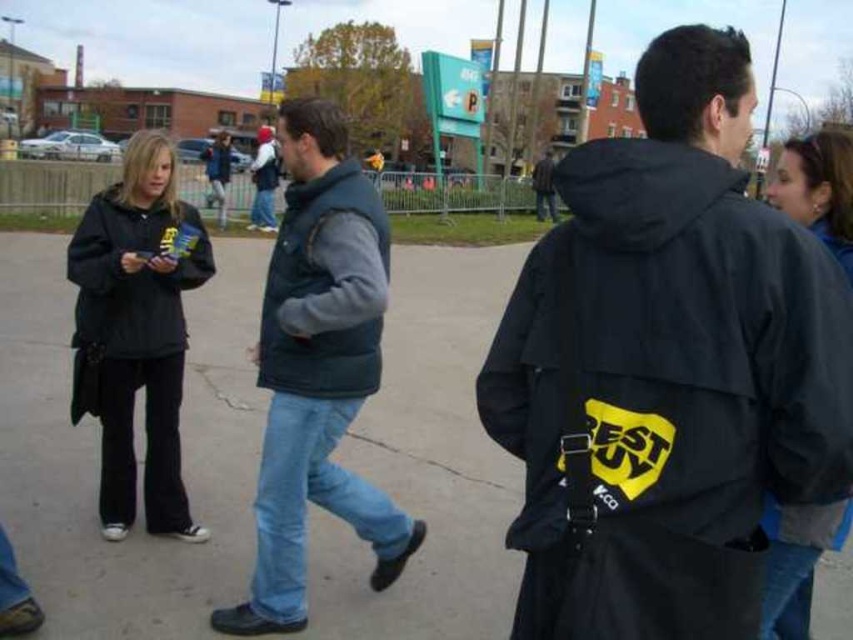
Question: Is dark blue denim jeans at center positioned at the back of blue denim jeans at center?

Choices:
 (A) yes
 (B) no

Answer: (B)

Question: Can you confirm if dark blue denim jeans at center is positioned below dark gray jacket at center?

Choices:
 (A) yes
 (B) no

Answer: (A)

Question: Which point is farther to the camera?

Choices:
 (A) (265, 204)
 (B) (555, 216)

Answer: (B)

Question: Which of these objects is positioned closest to the black matte jacket at left?

Choices:
 (A) black fabric jacket at center
 (B) dark gray jacket at upper right
 (C) blue denim jeans at center
 (D) dark gray jacket at center

Answer: (A)

Question: In this image, where is black matte jacket at left located relative to dark gray jacket at upper right?

Choices:
 (A) right
 (B) left

Answer: (B)

Question: Based on their relative distances, which object is farther from the black matte jacket at left?

Choices:
 (A) gray concrete pavement at center
 (B) denim jeans at center

Answer: (B)